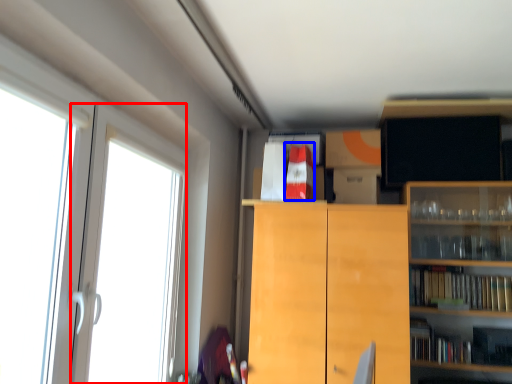
Question: Which object is further to the camera taking this photo, screen door (highlighted by a red box) or book (highlighted by a blue box)?

Choices:
 (A) screen door
 (B) book

Answer: (B)